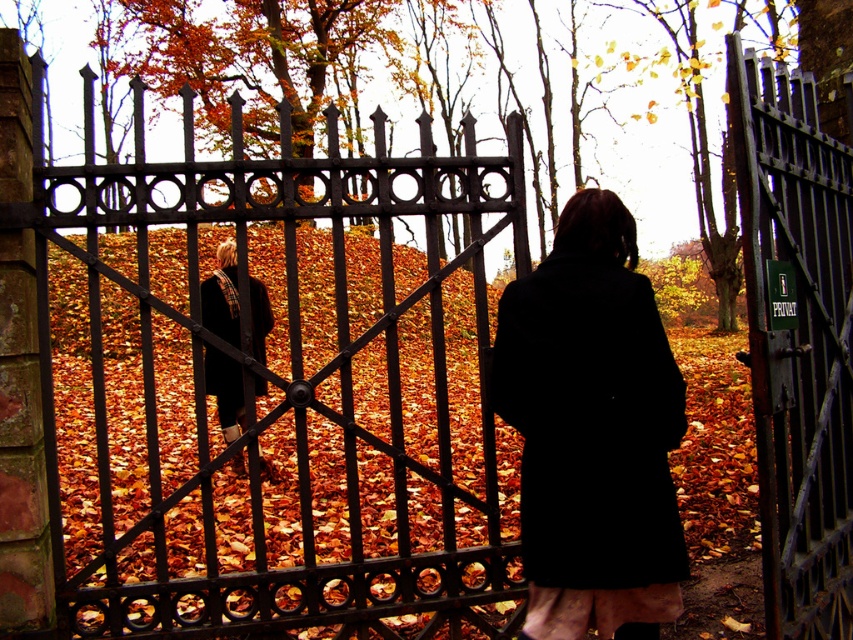
Is black wrought iron gate at center smaller than black matte coat at center?

No.

Which is more to the right, black wrought iron gate at center or black matte coat at center?

black matte coat at center is more to the right.

Is point (355, 436) positioned behind point (525, 307)?

That is True.

The height and width of the screenshot is (640, 853). In order to click on black wrought iron gate at center in this screenshot , I will do `click(276, 390)`.

Can you confirm if black wrought iron gate at center is positioned below dark iron gate at right?

No.

The image size is (853, 640). Describe the element at coordinates (276, 390) in the screenshot. I see `black wrought iron gate at center` at that location.

Where is `black wrought iron gate at center`? This screenshot has width=853, height=640. black wrought iron gate at center is located at coordinates (276, 390).

Is dark iron gate at right above black wool coat at center?

No.

Does dark iron gate at right appear on the right side of black wool coat at center?

Correct, you'll find dark iron gate at right to the right of black wool coat at center.

What do you see at coordinates (798, 340) in the screenshot? The image size is (853, 640). I see `dark iron gate at right` at bounding box center [798, 340].

Where is `dark iron gate at right`? dark iron gate at right is located at coordinates (798, 340).